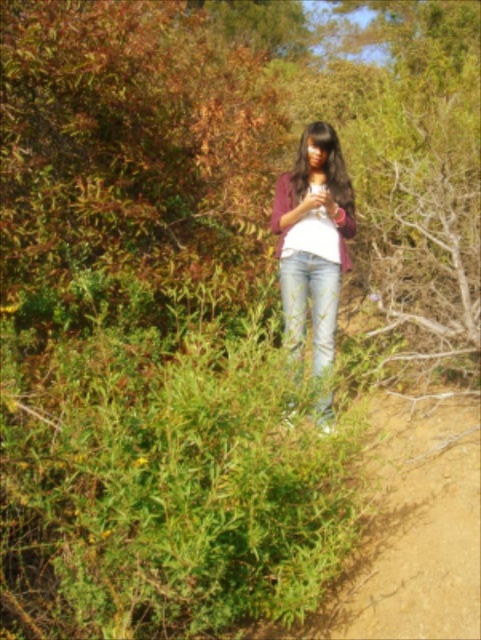
Question: Which object appears closest to the camera in this image?

Choices:
 (A) matte purple sweater at center
 (B) light blue denim jeans at center

Answer: (A)

Question: From the image, what is the correct spatial relationship of matte purple sweater at center in relation to light blue denim jeans at center?

Choices:
 (A) right
 (B) left

Answer: (A)

Question: Which point is closer to the camera?

Choices:
 (A) (329, 275)
 (B) (309, 214)

Answer: (A)

Question: Can you confirm if matte purple sweater at center is wider than light blue denim jeans at center?

Choices:
 (A) no
 (B) yes

Answer: (B)

Question: Can you confirm if matte purple sweater at center is thinner than light blue denim jeans at center?

Choices:
 (A) yes
 (B) no

Answer: (B)